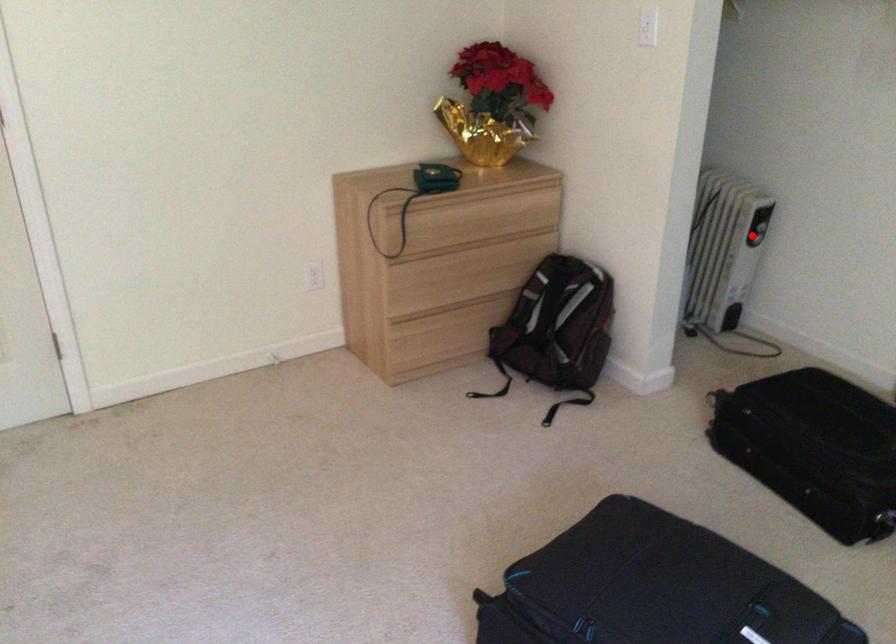
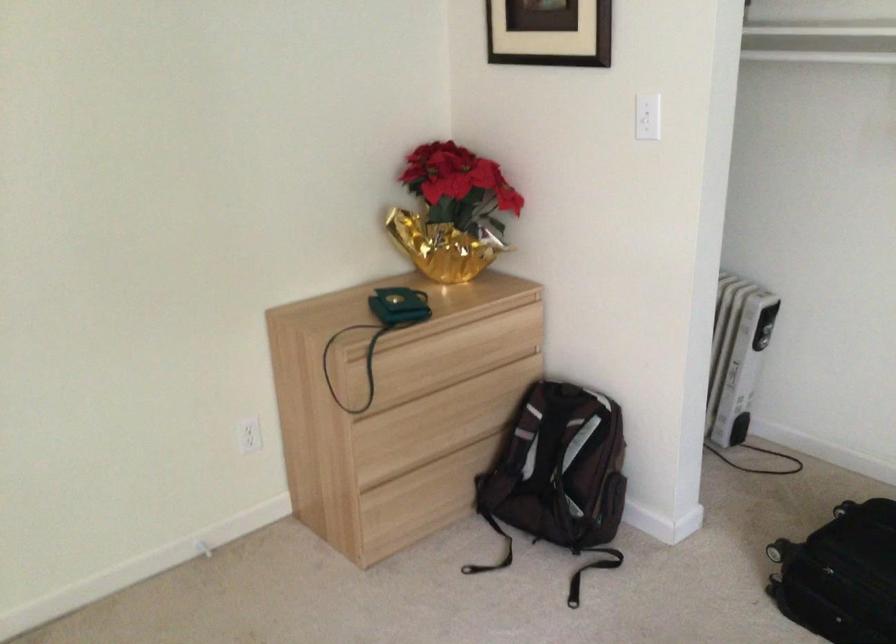
Locate, in the second image, the point that corresponds to the highlighted location in the first image.

(761, 339)